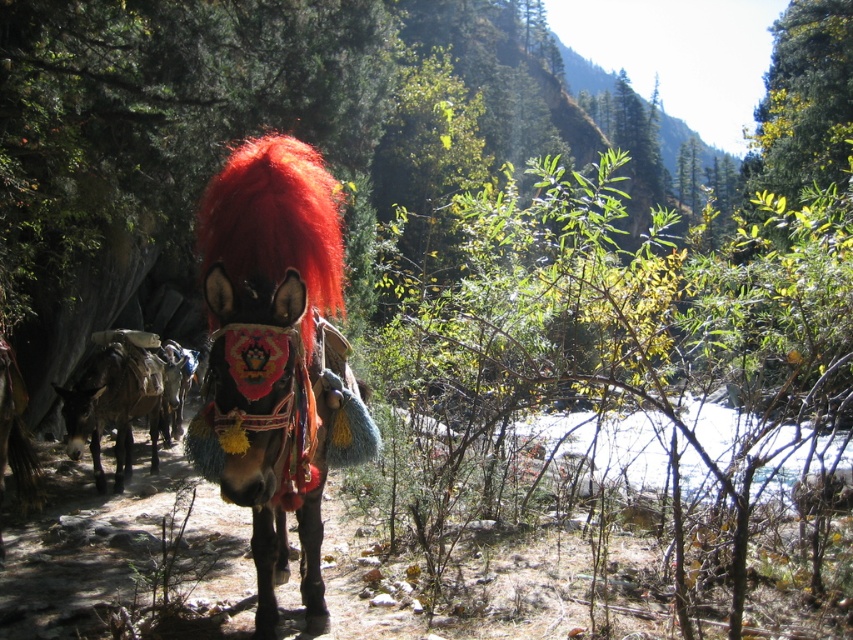
In the scene described, there is a shiny black donkey at center and a shiny red mane at center. From the perspective of an observer looking at the image, which object is positioned to the left of the other?

The shiny black donkey at center is to the left of the shiny red mane at center.